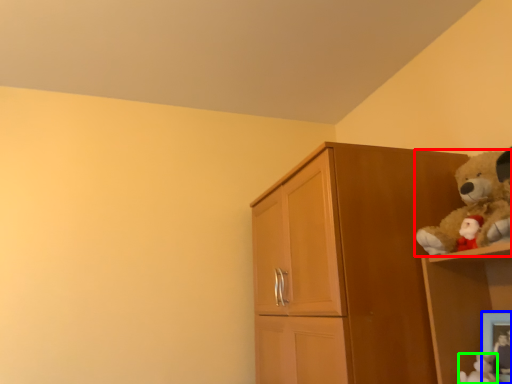
Question: Which object is the farthest from teddy bear (highlighted by a red box)? Choose among these: picture frame (highlighted by a blue box) or toy (highlighted by a green box).

Choices:
 (A) picture frame
 (B) toy

Answer: (B)